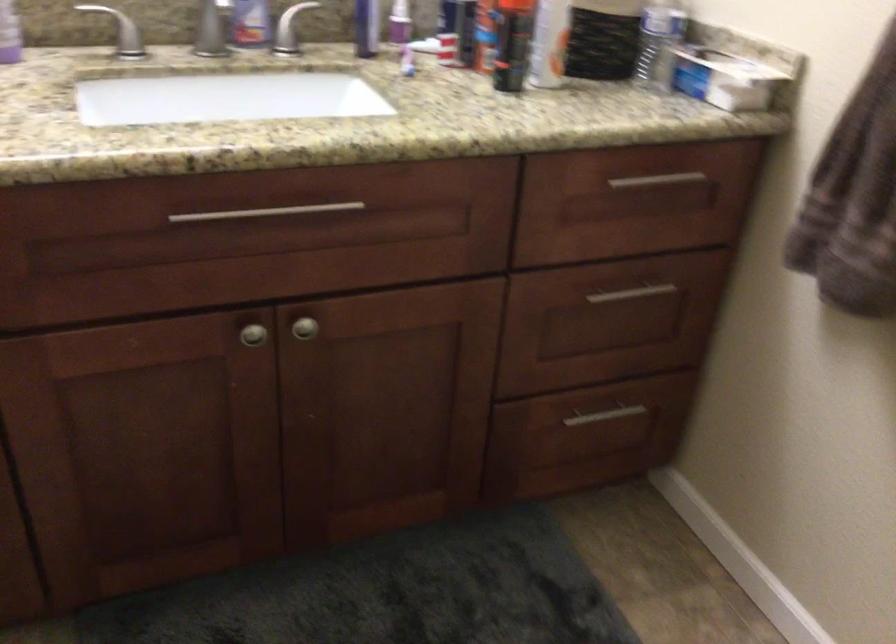
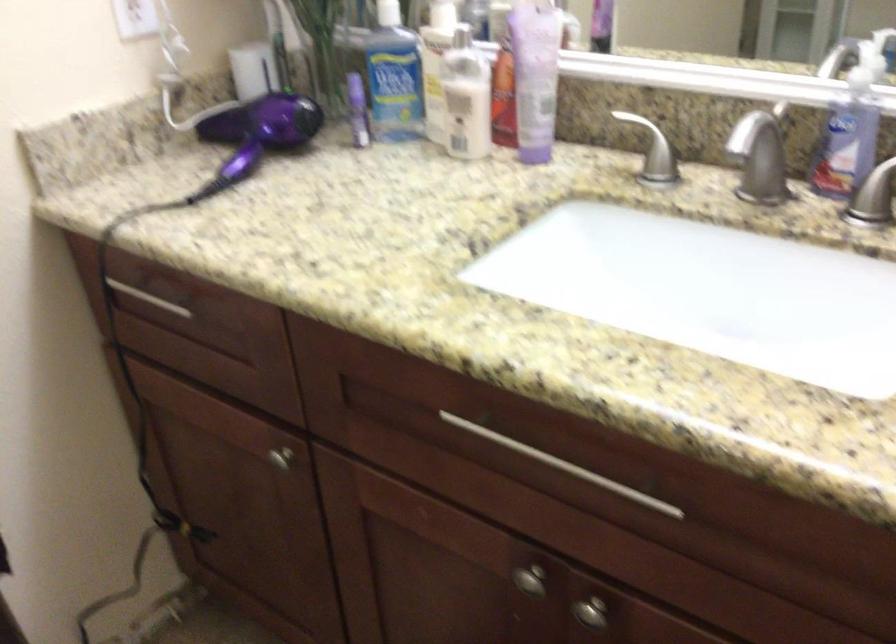
Locate, in the second image, the point that corresponds to point (257, 333) in the first image.

(530, 580)